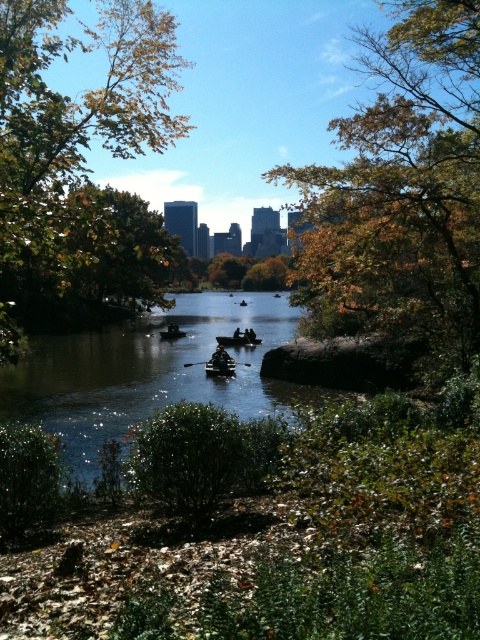
Question: Considering the relative positions of clear water at center and wooden canoe at center in the image provided, where is clear water at center located with respect to wooden canoe at center?

Choices:
 (A) above
 (B) below

Answer: (A)

Question: Which of the following is the farthest from the observer?

Choices:
 (A) coord(70,268)
 (B) coord(214,362)

Answer: (B)

Question: Which object is positioned closest to the green leafy tree at upper left?

Choices:
 (A) brown leafy tree at upper right
 (B) dark blue fabric boat at center
 (C) clear water at center

Answer: (C)

Question: Is black wood paddle at center below silhouette wooden boat at center?

Choices:
 (A) no
 (B) yes

Answer: (B)

Question: Can you confirm if clear water at center is positioned below dark blue fabric boat at center?

Choices:
 (A) yes
 (B) no

Answer: (B)

Question: Which of the following is the closest to the observer?

Choices:
 (A) (276, 280)
 (B) (249, 342)
 (C) (108, 272)
 (D) (472, 221)

Answer: (D)